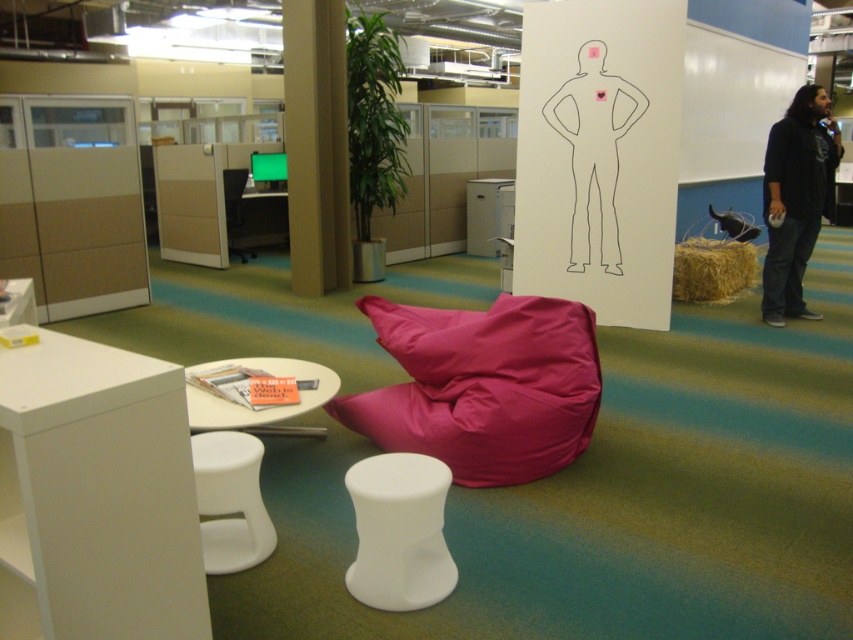
Who is taller, white glossy table at lower left or white glossy stool at center?

With more height is white glossy table at lower left.

Can you confirm if white glossy table at lower left is smaller than white glossy stool at center?

No, white glossy table at lower left is not smaller than white glossy stool at center.

Who is more distant from viewer, (157, 403) or (445, 595)?

Positioned behind is point (445, 595).

The image size is (853, 640). Identify the location of white glossy table at lower left. (96, 497).

Does white glossy table at lower left have a greater height compared to white matte stool at lower left?

Yes.

Does white glossy table at lower left appear on the right side of white matte stool at lower left?

In fact, white glossy table at lower left is to the left of white matte stool at lower left.

Is point (61, 496) in front of point (193, 460)?

That is True.

Find the location of a particular element. The height and width of the screenshot is (640, 853). white glossy table at lower left is located at coordinates tap(96, 497).

Between pink fabric bean bag at center and black cotton shirt at right, which one appears on the left side from the viewer's perspective?

pink fabric bean bag at center is more to the left.

Who is higher up, pink fabric bean bag at center or black cotton shirt at right?

black cotton shirt at right

Who is more distant from viewer, (503,435) or (773,166)?

Point (773,166)

At what (x,y) coordinates should I click in order to perform the action: click on pink fabric bean bag at center. Please return your answer as a coordinate pair (x, y). Looking at the image, I should click on (483, 387).